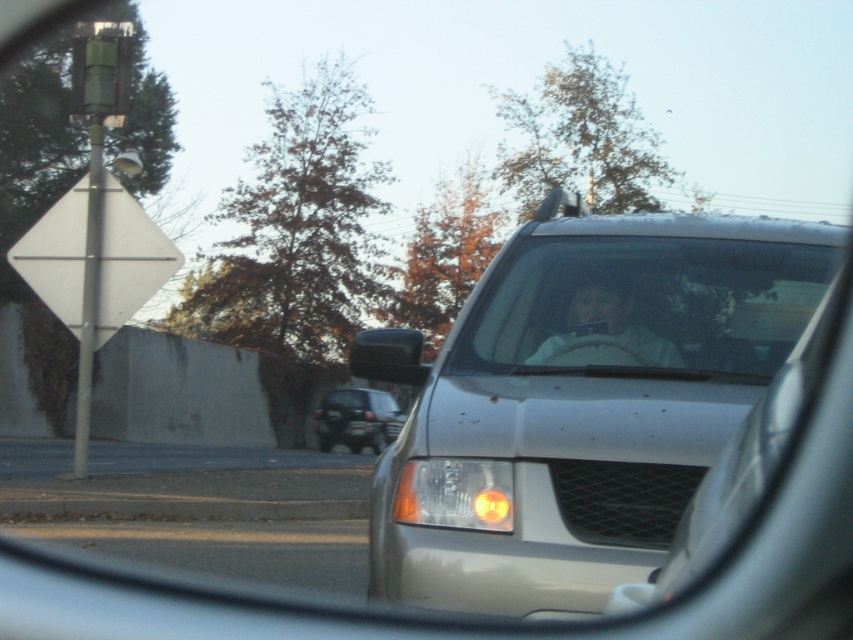
Question: Among these points, which one is farthest from the camera?

Choices:
 (A) (347, 362)
 (B) (347, 426)
 (C) (653, 477)

Answer: (A)

Question: Which object is positioned closest to the white matte diamond at left?

Choices:
 (A) black plastic license plate at center
 (B) black rubber rearview mirror at center
 (C) dark gray matte suv at center
 (D) satin silver van at center

Answer: (B)

Question: Which point appears farthest from the camera in this image?

Choices:
 (A) (408, 378)
 (B) (148, 252)

Answer: (B)

Question: Can you confirm if white matte diamond at left is positioned above black plastic license plate at center?

Choices:
 (A) yes
 (B) no

Answer: (A)

Question: Can you confirm if satin silver van at center is wider than clear glass windshield at center?

Choices:
 (A) yes
 (B) no

Answer: (B)

Question: Is clear glass windshield at center smaller than white matte diamond at left?

Choices:
 (A) no
 (B) yes

Answer: (B)